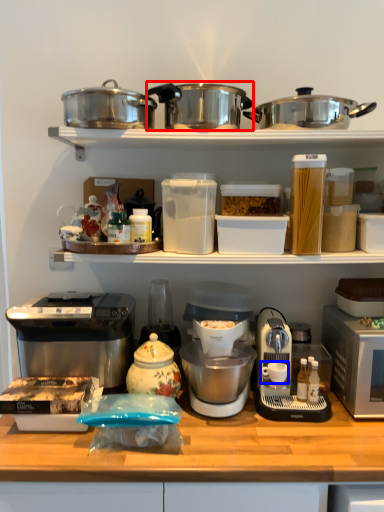
Question: Which point is closer to the camera, kitchen appliance (highlighted by a red box) or coffee cup (highlighted by a blue box)?

Choices:
 (A) kitchen appliance
 (B) coffee cup

Answer: (A)